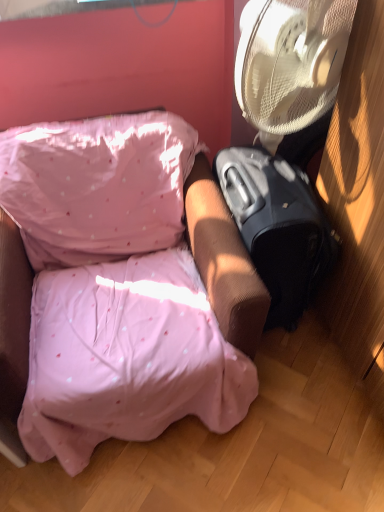
Identify the location of pink fabric couch at center. This screenshot has height=512, width=384. (127, 284).

This screenshot has height=512, width=384. What do you see at coordinates (127, 284) in the screenshot?
I see `pink fabric couch at center` at bounding box center [127, 284].

Image resolution: width=384 pixels, height=512 pixels. I want to click on black matte suitcase at right, so click(278, 227).

The width and height of the screenshot is (384, 512). Describe the element at coordinates (278, 227) in the screenshot. I see `black matte suitcase at right` at that location.

From the picture: Measure the distance between black matte suitcase at right and camera.

black matte suitcase at right is 1.03 meters from camera.

The height and width of the screenshot is (512, 384). I want to click on pink fabric couch at center, so click(x=127, y=284).

Looking at this image, is pink fabric couch at center at the right side of black matte suitcase at right?

No, pink fabric couch at center is not to the right of black matte suitcase at right.

Is pink fabric couch at center in front of black matte suitcase at right?

That is True.

Which point is more distant from viewer, (194, 359) or (290, 303)?

Positioned behind is point (290, 303).

From the image's perspective, is pink fabric couch at center located beneath black matte suitcase at right?

Correct, pink fabric couch at center appears lower than black matte suitcase at right in the image.

From a real-world perspective, is pink fabric couch at center on black matte suitcase at right?

Yes, from a real-world perspective, pink fabric couch at center is on top of black matte suitcase at right.

Does pink fabric couch at center have a greater width compared to black matte suitcase at right?

Yes.

Who is shorter, pink fabric couch at center or black matte suitcase at right?

Standing shorter between the two is black matte suitcase at right.

Considering the relative sizes of pink fabric couch at center and black matte suitcase at right in the image provided, is pink fabric couch at center smaller than black matte suitcase at right?

No, pink fabric couch at center is not smaller than black matte suitcase at right.

Is pink fabric couch at center not inside black matte suitcase at right?

Yes, pink fabric couch at center is outside of black matte suitcase at right.

Is pink fabric couch at center placed right next to black matte suitcase at right?

pink fabric couch at center and black matte suitcase at right are clearly separated.

Is pink fabric couch at center looking in the opposite direction of black matte suitcase at right?

No.

Identify the location of furniture on the left of black matte suitcase at right. This screenshot has width=384, height=512. (127, 284).

Which is more to the right, black matte suitcase at right or pink fabric couch at center?

Positioned to the right is black matte suitcase at right.

Is the position of black matte suitcase at right less distant than that of pink fabric couch at center?

That is False.

Does point (302, 290) appear closer or farther from the camera than point (56, 407)?

Point (302, 290) is positioned farther from the camera compared to point (56, 407).

From the image's perspective, between black matte suitcase at right and pink fabric couch at center, who is located below?

From the image's view, pink fabric couch at center is below.

From a real-world perspective, is black matte suitcase at right above or below pink fabric couch at center?

In terms of real-world spatial position, black matte suitcase at right is below pink fabric couch at center.

Is black matte suitcase at right wider or thinner than pink fabric couch at center?

In the image, black matte suitcase at right appears to be more narrow than pink fabric couch at center.

Who is shorter, black matte suitcase at right or pink fabric couch at center?

Standing shorter between the two is black matte suitcase at right.

Considering the relative sizes of black matte suitcase at right and pink fabric couch at center in the image provided, is black matte suitcase at right smaller than pink fabric couch at center?

Yes, black matte suitcase at right is smaller than pink fabric couch at center.

Is pink fabric couch at center located within black matte suitcase at right?

No, pink fabric couch at center is not inside black matte suitcase at right.

Are black matte suitcase at right and pink fabric couch at center far apart?

They are positioned close to each other.

Based on the photo, does black matte suitcase at right turn towards pink fabric couch at center?

No.

Can you tell me how much black matte suitcase at right and pink fabric couch at center differ in facing direction?

They differ by 94.3 degrees in their facing directions.

Locate an element on the screen. This screenshot has height=512, width=384. furniture lying on the left of black matte suitcase at right is located at coordinates (127, 284).

The image size is (384, 512). I want to click on furniture on the left of black matte suitcase at right, so click(127, 284).

At what (x,y) coordinates should I click in order to perform the action: click on luggage that is above the pink fabric couch at center (from the image's perspective). Please return your answer as a coordinate pair (x, y). The width and height of the screenshot is (384, 512). Looking at the image, I should click on (278, 227).